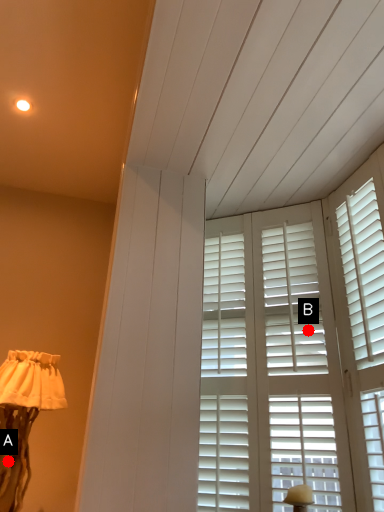
Question: Two points are circled on the image, labeled by A and B beside each circle. Which point is closer to the camera?

Choices:
 (A) A is closer
 (B) B is closer

Answer: (B)